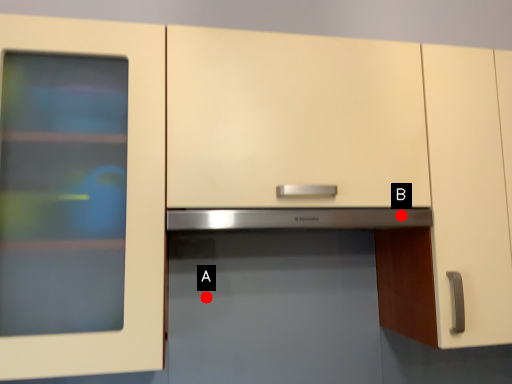
Question: Two points are circled on the image, labeled by A and B beside each circle. Which of the following is the closest to the observer?

Choices:
 (A) A is closer
 (B) B is closer

Answer: (A)